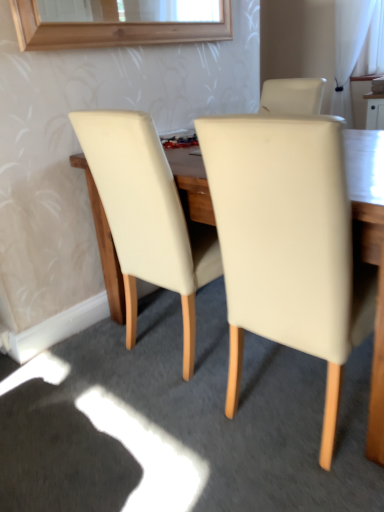
Question: Should I look upward or downward to see beige leather chair at center, arranged as the 2th chair when viewed from the right?

Choices:
 (A) down
 (B) up

Answer: (B)

Question: Does beige leather chair at center, acting as the 1th chair starting from the right, have a greater height compared to beige leather chair at center, which is counted as the 1th chair, starting from the left?

Choices:
 (A) no
 (B) yes

Answer: (B)

Question: From the image's perspective, is beige leather chair at center, acting as the 1th chair starting from the right, located above beige leather chair at center, which is counted as the 1th chair, starting from the left?

Choices:
 (A) yes
 (B) no

Answer: (B)

Question: Is beige leather chair at center, acting as the 1th chair starting from the right, shorter than beige leather chair at center, arranged as the 2th chair when viewed from the right?

Choices:
 (A) no
 (B) yes

Answer: (A)

Question: Is beige leather chair at center, acting as the 1th chair starting from the right, positioned with its back to beige leather chair at center, arranged as the 2th chair when viewed from the right?

Choices:
 (A) no
 (B) yes

Answer: (A)

Question: Can you confirm if beige leather chair at center, acting as the 1th chair starting from the right, is wider than beige leather chair at center, which is counted as the 1th chair, starting from the left?

Choices:
 (A) yes
 (B) no

Answer: (A)

Question: Is beige leather chair at center, acting as the 1th chair starting from the right, to the right of beige leather chair at center, arranged as the 2th chair when viewed from the right, from the viewer's perspective?

Choices:
 (A) yes
 (B) no

Answer: (A)

Question: From the image's perspective, would you say beige leather chair at center, arranged as the 2th chair when viewed from the right, is shown under white sheer curtain at upper right?

Choices:
 (A) no
 (B) yes

Answer: (B)

Question: Is beige leather chair at center, which is counted as the 1th chair, starting from the left, turned away from white sheer curtain at upper right?

Choices:
 (A) no
 (B) yes

Answer: (A)

Question: Is beige leather chair at center, which is counted as the 1th chair, starting from the left, positioned behind white sheer curtain at upper right?

Choices:
 (A) yes
 (B) no

Answer: (B)

Question: Is beige leather chair at center, arranged as the 2th chair when viewed from the right, touching white sheer curtain at upper right?

Choices:
 (A) no
 (B) yes

Answer: (A)

Question: Is beige leather chair at center, which is counted as the 1th chair, starting from the left, far away from white sheer curtain at upper right?

Choices:
 (A) no
 (B) yes

Answer: (B)

Question: Does beige leather chair at center, arranged as the 2th chair when viewed from the right, come in front of white sheer curtain at upper right?

Choices:
 (A) yes
 (B) no

Answer: (A)

Question: Can we say beige leather chair at center, acting as the 1th chair starting from the right, lies outside white sheer curtain at upper right?

Choices:
 (A) no
 (B) yes

Answer: (B)